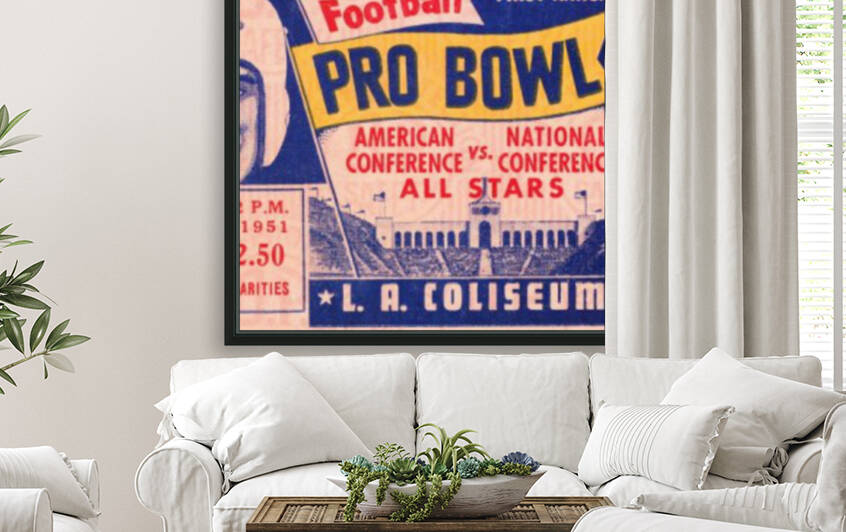
The image size is (846, 532). I want to click on sofa, so click(x=558, y=477).